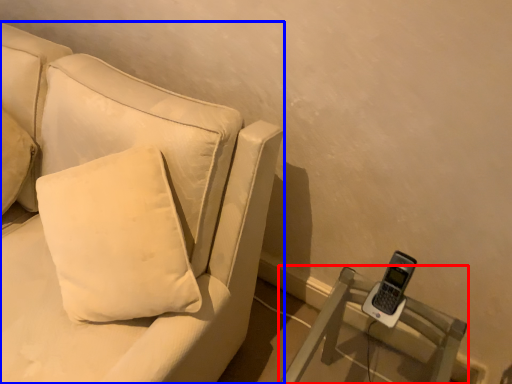
Question: Among these objects, which one is farthest to the camera, furniture (highlighted by a red box) or studio couch (highlighted by a blue box)?

Choices:
 (A) furniture
 (B) studio couch

Answer: (A)